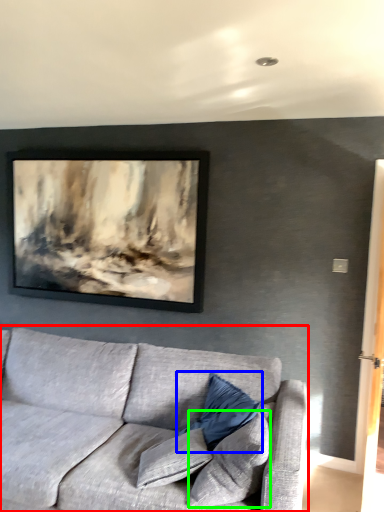
Question: Considering the real-world distances, which object is closest to studio couch (highlighted by a red box)? pillow (highlighted by a blue box) or pillow (highlighted by a green box).

Choices:
 (A) pillow
 (B) pillow

Answer: (A)